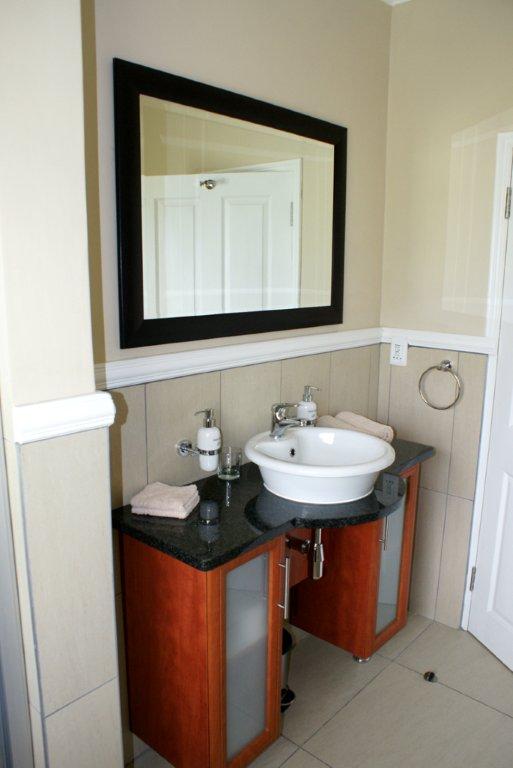
Where is `faucet`? This screenshot has height=768, width=513. faucet is located at coordinates (280, 426).